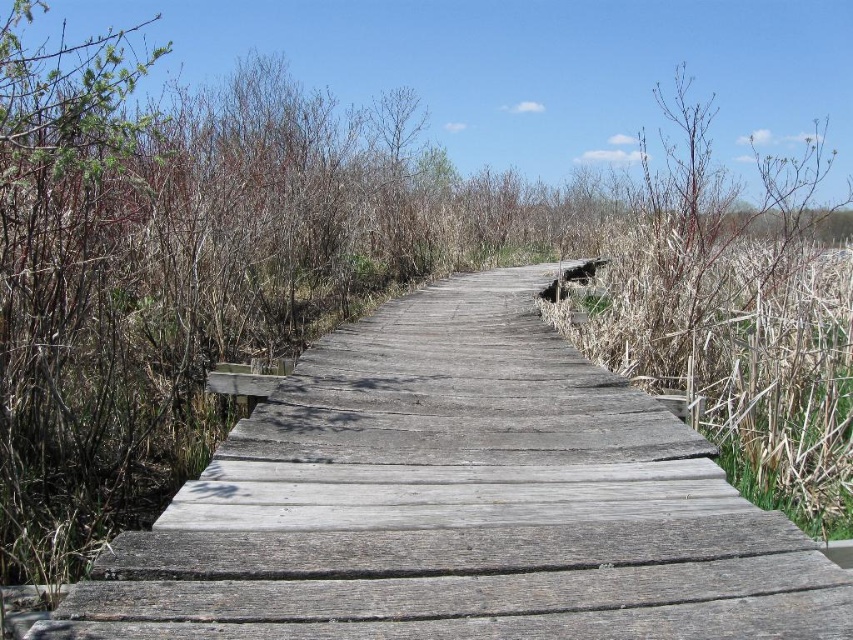
Question: Which point appears farthest from the camera in this image?

Choices:
 (A) pyautogui.click(x=743, y=301)
 (B) pyautogui.click(x=773, y=561)

Answer: (A)

Question: Is weathered wood trail at center to the right of dry grass at right from the viewer's perspective?

Choices:
 (A) no
 (B) yes

Answer: (A)

Question: Does weathered wood trail at center have a larger size compared to dry grass at right?

Choices:
 (A) yes
 (B) no

Answer: (B)

Question: Among these objects, which one is farthest from the camera?

Choices:
 (A) weathered wood trail at center
 (B) dry grass at right

Answer: (B)

Question: Can you confirm if weathered wood trail at center is positioned to the left of dry grass at right?

Choices:
 (A) yes
 (B) no

Answer: (A)

Question: Which point is closer to the camera taking this photo?

Choices:
 (A) (338, 550)
 (B) (795, 451)

Answer: (A)